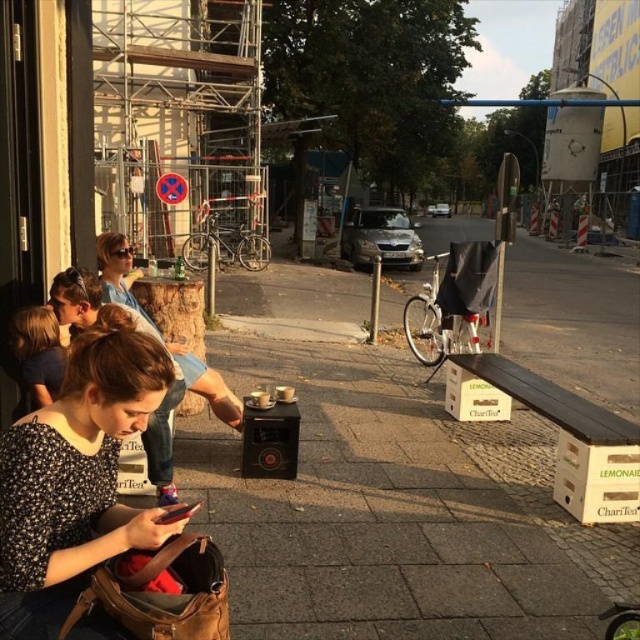
You are a photographer positioned at the camera. You want to take a photo that includes both the point at (630, 438) and the point at (19, 369). Which point should you focus on first to ensure both are in sharp focus?

You should focus on the point at (630, 438) first because it is further away from the camera compared to the point at (19, 369). By focusing on the farther point, the closer point will also be within the depth of field, ensuring both are in sharp focus.

You are a photographer trying to capture a candid shot of the two people wearing the floral print shirt at center and the spotted floral blouse at lower left. Since you want to ensure both subjects are in the frame, which one should you focus on first to account for their positions?

The spotted floral blouse at lower left should be focused on first because the floral print shirt at center is located below it, ensuring both will be in the frame when starting from the higher position.